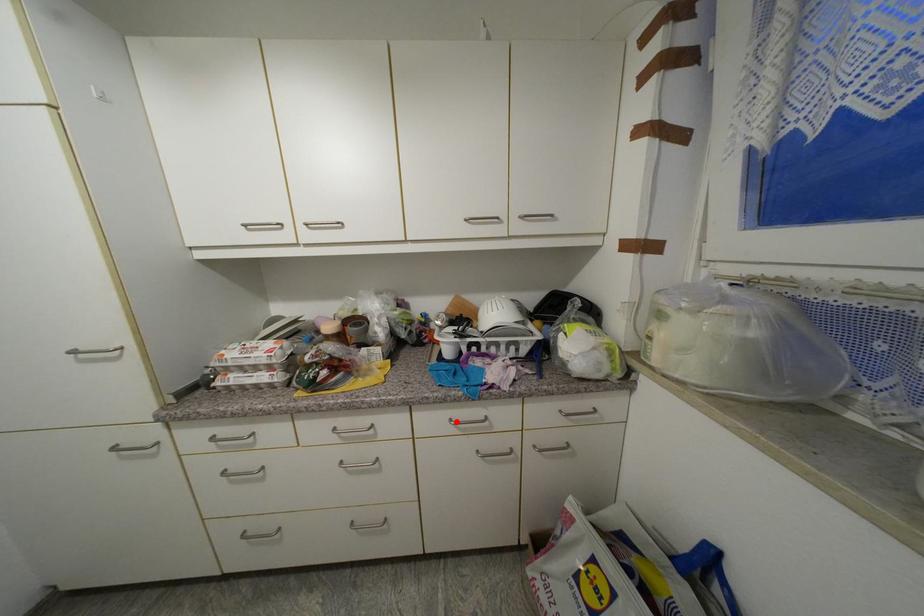
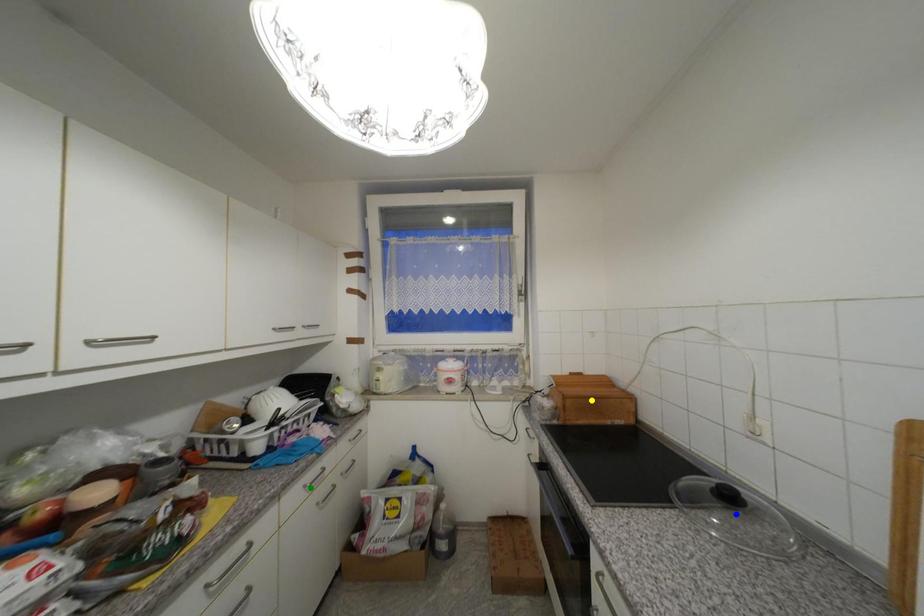
Question: I am providing you with two images of the same scene from different viewpoints. A red point is marked on the first image. You are given multiple points on the second image. Can you choose the point in image 2 that corresponds to the point in image 1?

Choices:
 (A) blue point
 (B) yellow point
 (C) green point

Answer: (C)